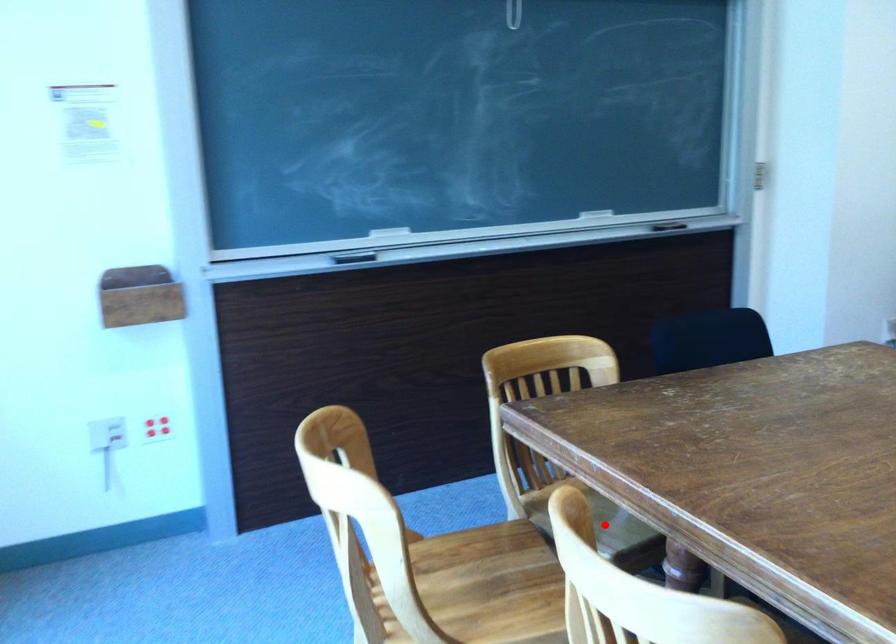
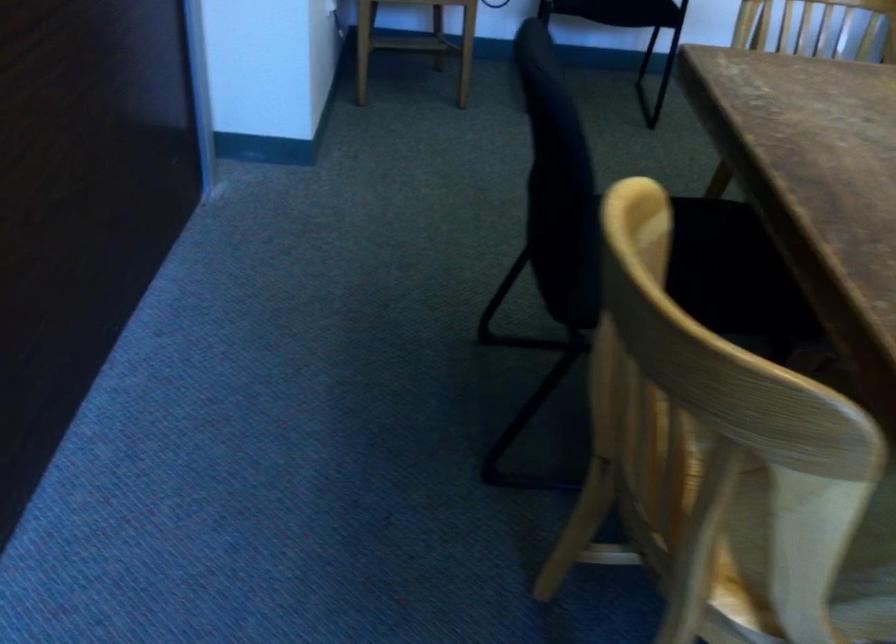
Locate, in the second image, the point that corresponds to the highlighted location in the first image.

(872, 538)